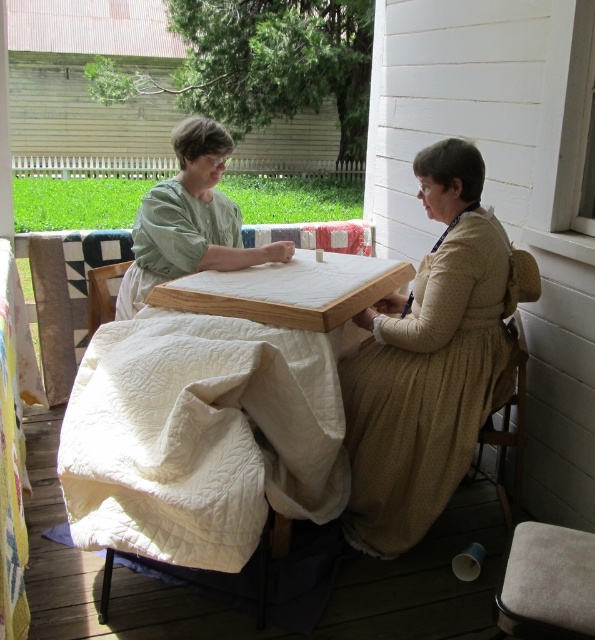
You are a tailor working on a project and need to determine which fabric to use. Given the light brown cotton dress at center and the white quilted fabric at left, which one is smaller in size?

The light brown cotton dress at center has a smaller size compared to the white quilted fabric at left, so the light brown cotton dress at center is the smaller one.

You are a guest at this historical gathering and want to place a small vase between the white quilted cloth at center and the green matte fabric at center on the table. The vase is 10 inches wide. Will there be enough space between them to fit the vase?

The white quilted cloth at center is 29.75 inches from the green matte fabric at center. Since the vase is only 10 inches wide, there is sufficient space between the two fabrics to place the vase.

You are a tailor working on a project and need to determine which fabric to use next. Given the light brown cotton dress at center and the white quilted fabric at left, which one is taller?

The light brown cotton dress at center is taller than the white quilted fabric at left.